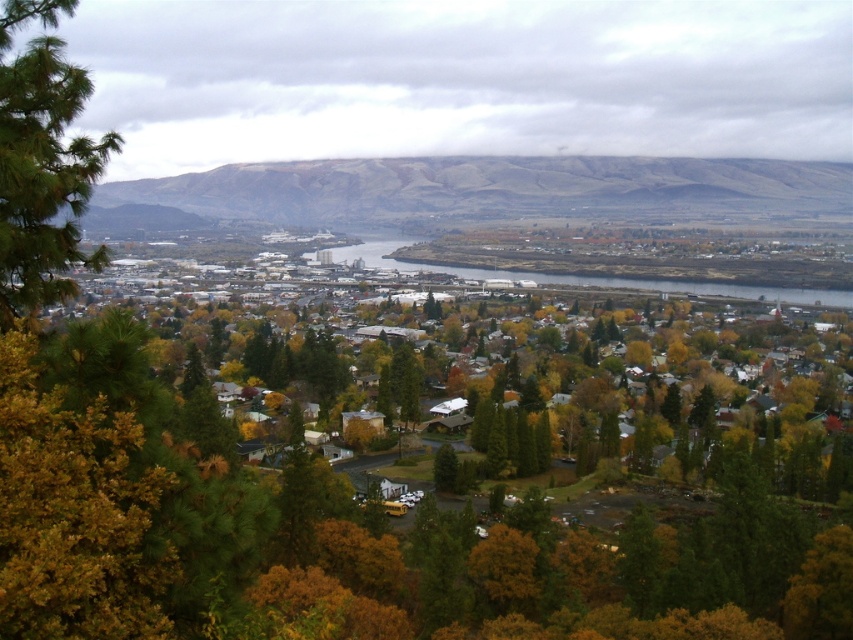
Can you confirm if brown/dry soil at upper center is bigger than green pine tree at left?

Correct, brown/dry soil at upper center is larger in size than green pine tree at left.

Where is `brown/dry soil at upper center`? brown/dry soil at upper center is located at coordinates (488, 192).